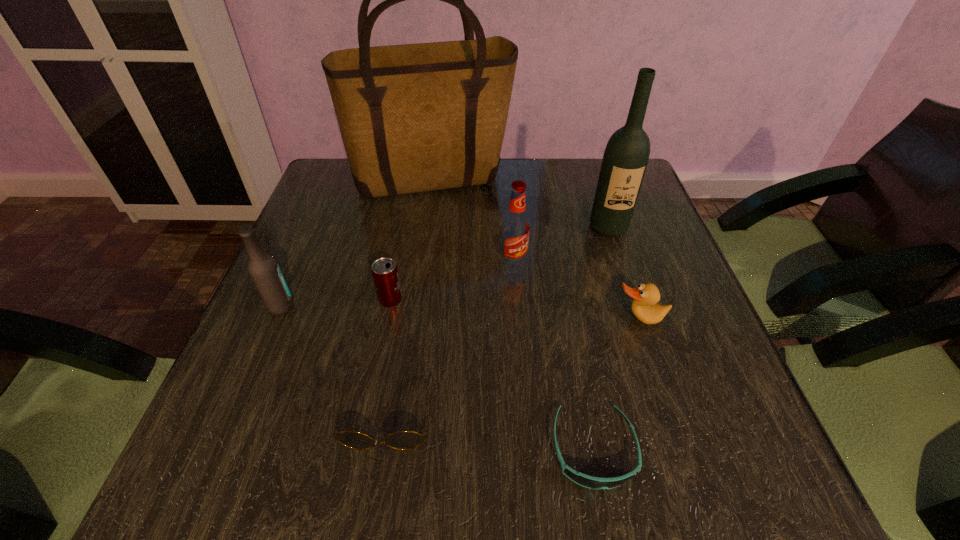
You are a GUI agent. You are given a task and a screenshot of the screen. Output one action in this format:
    pyautogui.click(x=<x>, y=<y>)
    Task: Click on the tote bag that is positioned at the left edge
    This screenshot has width=960, height=540.
    Given the screenshot: What is the action you would take?
    pyautogui.click(x=420, y=117)

This screenshot has height=540, width=960. I want to click on beer bottle located at the left edge, so click(263, 269).

Where is `wine bottle at the right edge`? The height and width of the screenshot is (540, 960). wine bottle at the right edge is located at coordinates (625, 159).

Where is `duck at the right edge`? This screenshot has width=960, height=540. duck at the right edge is located at coordinates (646, 296).

The height and width of the screenshot is (540, 960). What are the coordinates of `object present at the far left corner` in the screenshot? It's located at (420, 117).

Where is `vacant space at the far edge of the desktop`? The image size is (960, 540). vacant space at the far edge of the desktop is located at coordinates (555, 176).

Locate an element on the screen. blank space at the near edge of the desktop is located at coordinates (332, 444).

In the image, there is a desktop. Find the location of `vacant space at the left edge`. vacant space at the left edge is located at coordinates (351, 208).

This screenshot has height=540, width=960. In order to click on free point at the right edge in this screenshot , I will do `click(633, 329)`.

Image resolution: width=960 pixels, height=540 pixels. I want to click on blank area at the far left corner, so click(x=337, y=187).